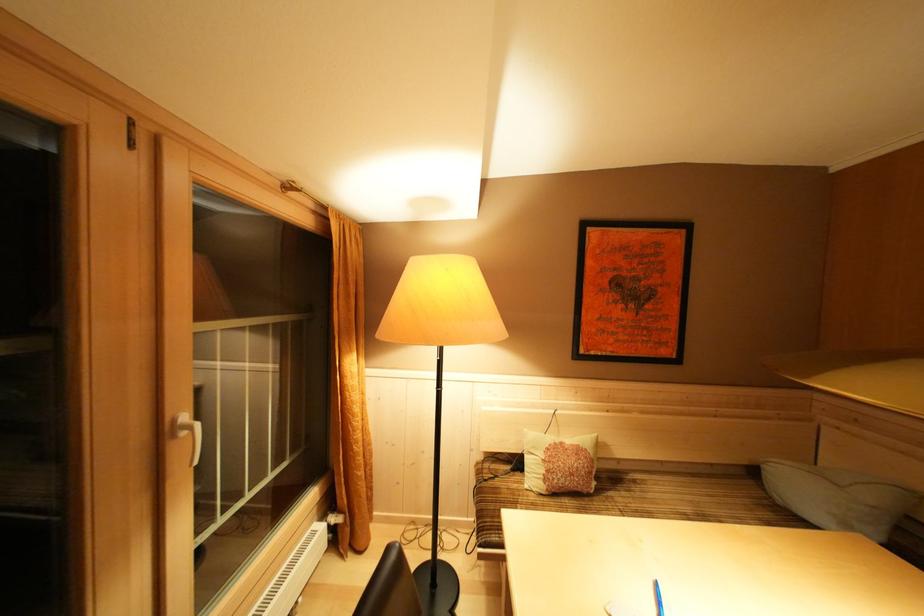
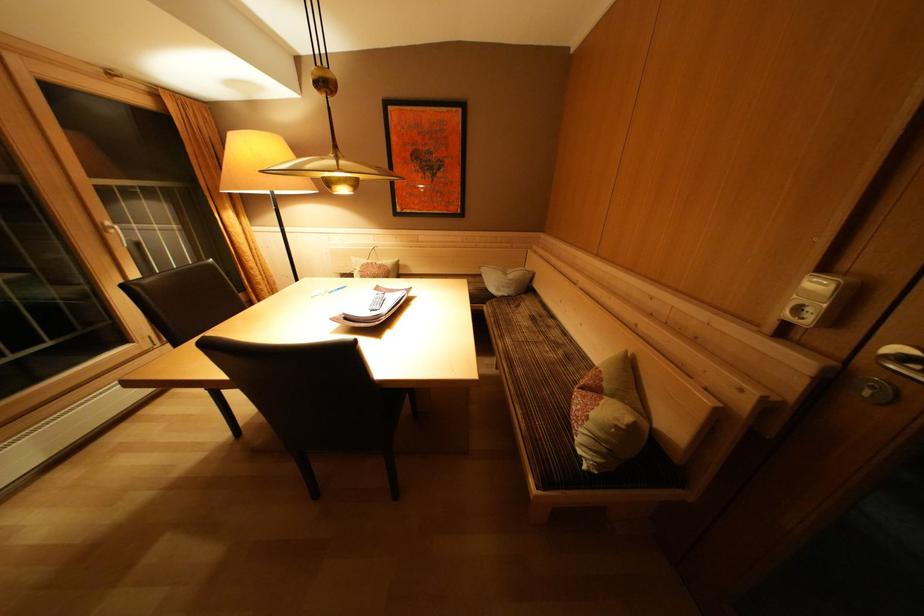
Find the pixel in the second image that matches [568,448] in the first image.

(379, 268)